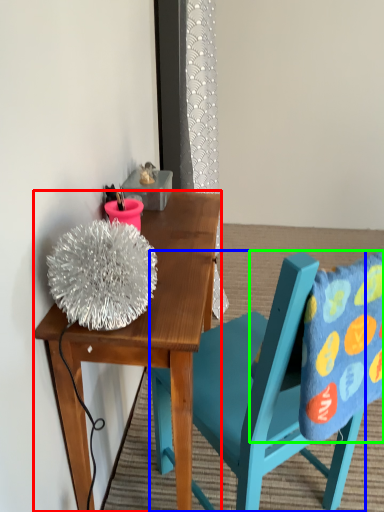
Question: Considering the real-world distances, which object is closest to desk (highlighted by a red box)? chair (highlighted by a blue box) or pillow (highlighted by a green box).

Choices:
 (A) chair
 (B) pillow

Answer: (A)